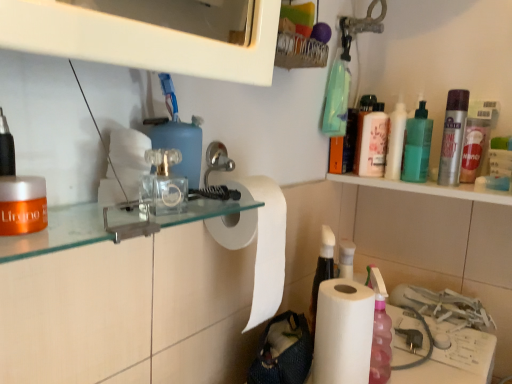
Question: In the image, is green translucent bottle at upper right, the third mouthwash in the front-to-back sequence, positioned in front of or behind pink glossy mouthwash at upper right, which is counted as the 3th mouthwash, starting from the right?

Choices:
 (A) behind
 (B) front

Answer: (B)

Question: Considering the positions of green translucent bottle at upper right, the third mouthwash in the front-to-back sequence, and pink glossy mouthwash at upper right, which is counted as the 3th mouthwash, starting from the right, in the image, is green translucent bottle at upper right, the third mouthwash in the front-to-back sequence, taller or shorter than pink glossy mouthwash at upper right, which is counted as the 3th mouthwash, starting from the right,?

Choices:
 (A) tall
 (B) short

Answer: (A)

Question: Based on their relative distances, which object is nearer to the silver metallic mouthwash at upper right, arranged as the first mouthwash when viewed from the right?

Choices:
 (A) white glossy bottle at upper right
 (B) green translucent bottle at upper right, acting as the 2th mouthwash starting from the back
 (C) pink glossy mouthwash at upper right, the 2th mouthwash positioned from the left
 (D) orange matte jar at left, which appears as the fourth mouthwash when viewed from the right
 (E) white matte paper towel at center, the 2th paper towel in the right-to-left sequence

Answer: (B)

Question: Considering the real-world distances, which object is closest to the green translucent bottle at upper right, acting as the 2th mouthwash starting from the back?

Choices:
 (A) clear plastic toilet paper at center
 (B) white paper at lower right, the second paper towel in the left-to-right sequence
 (C) orange matte jar at left, which appears as the fourth mouthwash when viewed from the right
 (D) pink glossy mouthwash at upper right, the 2th mouthwash positioned from the left
 (E) orange matte jar at left

Answer: (D)